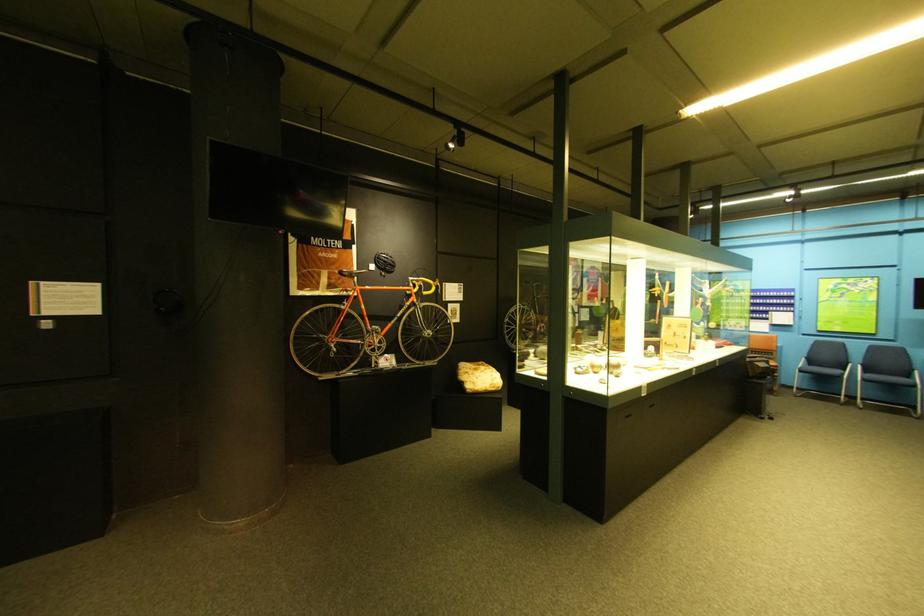
Locate an element on the screen. yellow bicycle handlebar is located at coordinates (423, 280).